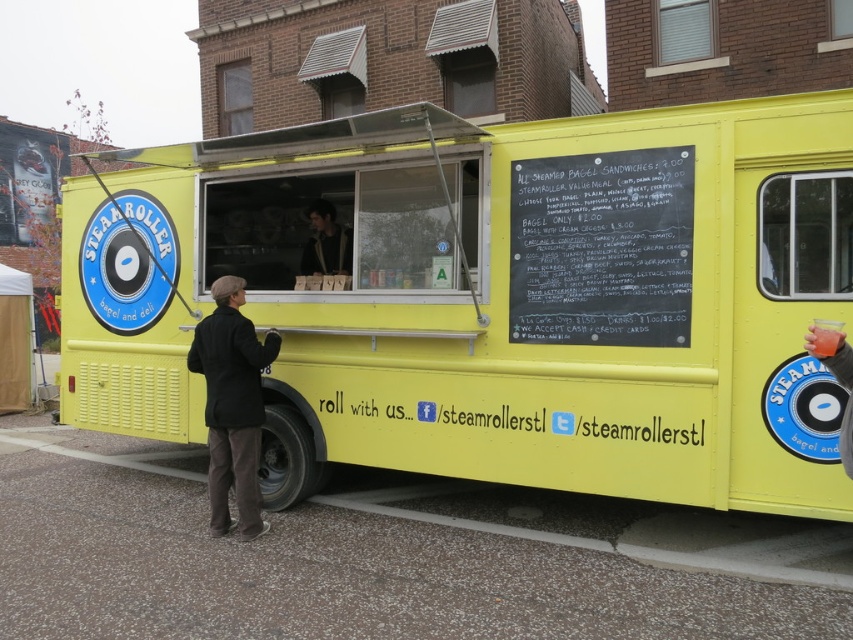
Question: Is yellow matte food truck at center to the left of dark brown leather jacket at center from the viewer's perspective?

Choices:
 (A) yes
 (B) no

Answer: (B)

Question: Does yellow matte food truck at center have a larger size compared to black chalkboard at upper center?

Choices:
 (A) no
 (B) yes

Answer: (B)

Question: Which of the following is the closest to the observer?

Choices:
 (A) dark brown leather jacket at center
 (B) black chalkboard at upper center

Answer: (B)

Question: Is yellow matte food truck at center behind dark brown leather jacket at center?

Choices:
 (A) yes
 (B) no

Answer: (B)

Question: Among these objects, which one is nearest to the camera?

Choices:
 (A) black chalkboard at upper center
 (B) black wool coat at lower left

Answer: (A)

Question: Which point is closer to the camera?

Choices:
 (A) (329, 237)
 (B) (213, 497)

Answer: (B)